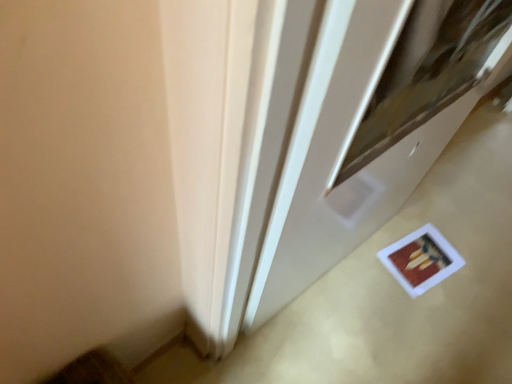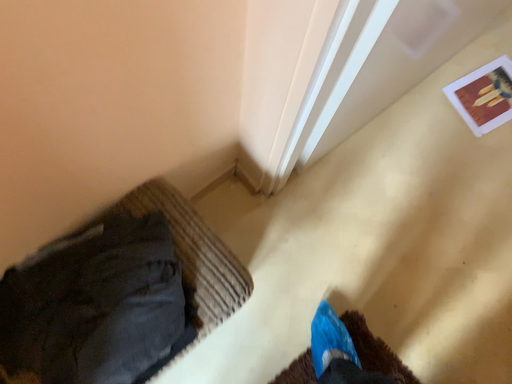
Question: Which way did the camera rotate in the video?

Choices:
 (A) rotated downward
 (B) rotated upward

Answer: (A)